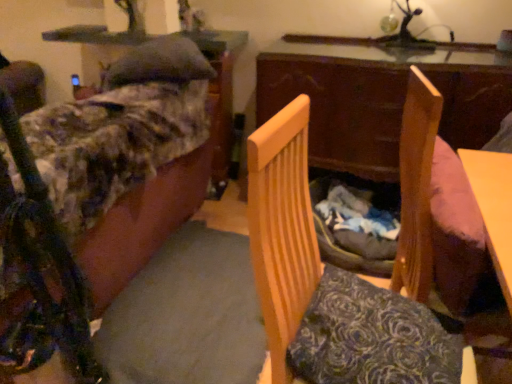
Identify the location of fluffy fabric couch at left, positioned as the second furniture in right-to-left order. (92, 202).

Describe the element at coordinates (416, 186) in the screenshot. I see `wooden swivel chair at right` at that location.

Find the location of a particular element. This screenshot has height=384, width=512. fluffy fabric couch at left, marked as the 1th furniture in a left-to-right arrangement is located at coordinates (92, 202).

Is the position of wooden swivel chair at right more distant than that of wooden table at center?

That is False.

From a real-world perspective, is wooden swivel chair at right located beneath wooden table at center?

Indeed, from a real-world perspective, wooden swivel chair at right is positioned beneath wooden table at center.

Which object is positioned more to the right, wooden swivel chair at right or wooden table at center?

wooden table at center.

Does point (416, 250) come in front of point (307, 38)?

That is True.

Is wooden chair at center, the 1th furniture positioned from the right, taller than wooden swivel chair at right?

Yes.

Can you confirm if wooden chair at center, the 1th furniture positioned from the right, is wider than wooden swivel chair at right?

Correct, the width of wooden chair at center, the 1th furniture positioned from the right, exceeds that of wooden swivel chair at right.

Based on the photo, which is correct: wooden chair at center, the 2th furniture viewed from the left, is inside wooden swivel chair at right, or outside of it?

wooden chair at center, the 2th furniture viewed from the left, is not enclosed by wooden swivel chair at right.

Does wooden chair at center, the 1th furniture positioned from the right, turn towards wooden swivel chair at right?

No, wooden chair at center, the 1th furniture positioned from the right, is not aimed at wooden swivel chair at right.

Identify the location of furniture that is the 1st one below the wooden table at center (from a real-world perspective). click(x=282, y=231).

Does wooden table at center have a greater width compared to wooden chair at center, the 2th furniture viewed from the left?

Yes, wooden table at center is wider than wooden chair at center, the 2th furniture viewed from the left.

From a real-world perspective, which object rests below the other?

wooden chair at center, the 2th furniture viewed from the left.

Considering the sizes of objects wooden table at center and wooden chair at center, the 2th furniture viewed from the left, in the image provided, who is smaller, wooden table at center or wooden chair at center, the 2th furniture viewed from the left,?

wooden chair at center, the 2th furniture viewed from the left, is smaller.

Is fluffy fabric couch at left, positioned as the second furniture in right-to-left order, touching wooden table at center?

fluffy fabric couch at left, positioned as the second furniture in right-to-left order, is not next to wooden table at center, and they're not touching.

Does fluffy fabric couch at left, marked as the 1th furniture in a left-to-right arrangement, contain wooden table at center?

No, wooden table at center is not a part of fluffy fabric couch at left, marked as the 1th furniture in a left-to-right arrangement.

From the wooden table at center, count the 2nd furniture to the left and point to it. Please provide its 2D coordinates.

[(92, 202)]

Can we say wooden swivel chair at right lies outside wooden chair at center, the 2th furniture viewed from the left?

That's correct, wooden swivel chair at right is outside of wooden chair at center, the 2th furniture viewed from the left.

Does wooden swivel chair at right touch wooden chair at center, the 1th furniture positioned from the right?

No, wooden swivel chair at right is not with wooden chair at center, the 1th furniture positioned from the right.

From a real-world perspective, does wooden swivel chair at right stand above wooden chair at center, the 2th furniture viewed from the left?

Correct, in the physical world, wooden swivel chair at right is higher than wooden chair at center, the 2th furniture viewed from the left.

From the image's perspective, would you say wooden swivel chair at right is shown under wooden chair at center, the 2th furniture viewed from the left?

Actually, wooden swivel chair at right appears above wooden chair at center, the 2th furniture viewed from the left, in the image.

Between wooden swivel chair at right and fluffy fabric couch at left, positioned as the second furniture in right-to-left order, which one has larger width?

fluffy fabric couch at left, positioned as the second furniture in right-to-left order, is wider.

Would you say wooden swivel chair at right is a long distance from fluffy fabric couch at left, marked as the 1th furniture in a left-to-right arrangement?

Absolutely, wooden swivel chair at right is distant from fluffy fabric couch at left, marked as the 1th furniture in a left-to-right arrangement.

Does wooden swivel chair at right appear on the left side of fluffy fabric couch at left, positioned as the second furniture in right-to-left order?

No, wooden swivel chair at right is not to the left of fluffy fabric couch at left, positioned as the second furniture in right-to-left order.

Based on the photo, from a real-world perspective, is wooden swivel chair at right above or below fluffy fabric couch at left, positioned as the second furniture in right-to-left order?

wooden swivel chair at right is situated higher than fluffy fabric couch at left, positioned as the second furniture in right-to-left order, in the real world.

Does wooden chair at center, the 1th furniture positioned from the right, turn towards fluffy fabric couch at left, marked as the 1th furniture in a left-to-right arrangement?

No, wooden chair at center, the 1th furniture positioned from the right, does not turn towards fluffy fabric couch at left, marked as the 1th furniture in a left-to-right arrangement.

Is wooden chair at center, the 1th furniture positioned from the right, next to fluffy fabric couch at left, positioned as the second furniture in right-to-left order?

No, wooden chair at center, the 1th furniture positioned from the right, is not making contact with fluffy fabric couch at left, positioned as the second furniture in right-to-left order.

Consider the image. Considering the relative sizes of wooden chair at center, the 2th furniture viewed from the left, and fluffy fabric couch at left, positioned as the second furniture in right-to-left order, in the image provided, is wooden chair at center, the 2th furniture viewed from the left, thinner than fluffy fabric couch at left, positioned as the second furniture in right-to-left order,?

Yes.

Is wooden chair at center, the 2th furniture viewed from the left, further to camera compared to fluffy fabric couch at left, marked as the 1th furniture in a left-to-right arrangement?

No, it is in front of fluffy fabric couch at left, marked as the 1th furniture in a left-to-right arrangement.

The height and width of the screenshot is (384, 512). I want to click on swivel chair in front of the wooden table at center, so click(416, 186).

Find the location of a particular element. The image size is (512, 384). furniture below the wooden swivel chair at right (from the image's perspective) is located at coordinates (282, 231).

Considering their positions, is wooden chair at center, the 1th furniture positioned from the right, positioned closer to fluffy fabric couch at left, marked as the 1th furniture in a left-to-right arrangement, than wooden swivel chair at right?

wooden chair at center, the 1th furniture positioned from the right.

Estimate the real-world distances between objects in this image. Which object is closer to wooden swivel chair at right, wooden table at center or wooden chair at center, the 2th furniture viewed from the left?

wooden chair at center, the 2th furniture viewed from the left.

Based on their spatial positions, is wooden swivel chair at right or wooden table at center closer to fluffy fabric couch at left, marked as the 1th furniture in a left-to-right arrangement?

wooden table at center is positioned closer to the anchor fluffy fabric couch at left, marked as the 1th furniture in a left-to-right arrangement.

Based on the photo, looking at the image, which one is located further to wooden chair at center, the 1th furniture positioned from the right, wooden table at center or wooden swivel chair at right?

wooden table at center is further to wooden chair at center, the 1th furniture positioned from the right.

Looking at the image, which one is located further to fluffy fabric couch at left, marked as the 1th furniture in a left-to-right arrangement, wooden chair at center, the 2th furniture viewed from the left, or wooden table at center?

wooden table at center lies further to fluffy fabric couch at left, marked as the 1th furniture in a left-to-right arrangement, than the other object.

Considering their positions, is wooden chair at center, the 2th furniture viewed from the left, positioned further to wooden swivel chair at right than wooden table at center?

wooden table at center.

Based on their spatial positions, is wooden swivel chair at right or wooden chair at center, the 2th furniture viewed from the left, closer to wooden table at center?

Among the two, wooden swivel chair at right is located nearer to wooden table at center.

Based on their spatial positions, is fluffy fabric couch at left, marked as the 1th furniture in a left-to-right arrangement, or wooden swivel chair at right further from wooden chair at center, the 1th furniture positioned from the right?

fluffy fabric couch at left, marked as the 1th furniture in a left-to-right arrangement, is positioned further to the anchor wooden chair at center, the 1th furniture positioned from the right.

You are a GUI agent. You are given a task and a screenshot of the screen. Output one action in this format:
    pyautogui.click(x=<x>, y=<y>)
    Task: Click on the swivel chair located between fluffy fabric couch at left, positioned as the second furniture in right-to-left order, and wooden table at center in the left-right direction
    
    Given the screenshot: What is the action you would take?
    pyautogui.click(x=416, y=186)

Image resolution: width=512 pixels, height=384 pixels. Find the location of `swivel chair between wooden chair at center, the 1th furniture positioned from the right, and wooden table at center in the front-back direction`. swivel chair between wooden chair at center, the 1th furniture positioned from the right, and wooden table at center in the front-back direction is located at coordinates (416, 186).

You are a GUI agent. You are given a task and a screenshot of the screen. Output one action in this format:
    pyautogui.click(x=<x>, y=<y>)
    Task: Click on the furniture between fluffy fabric couch at left, positioned as the second furniture in right-to-left order, and wooden swivel chair at right from left to right
    
    Given the screenshot: What is the action you would take?
    pyautogui.click(x=282, y=231)

I want to click on furniture located between fluffy fabric couch at left, marked as the 1th furniture in a left-to-right arrangement, and wooden table at center in the left-right direction, so click(282, 231).